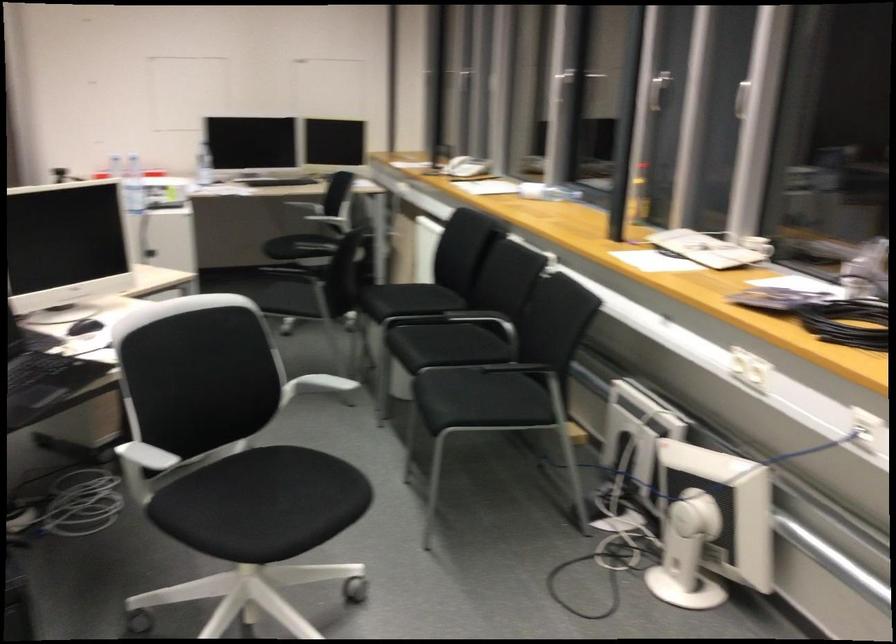
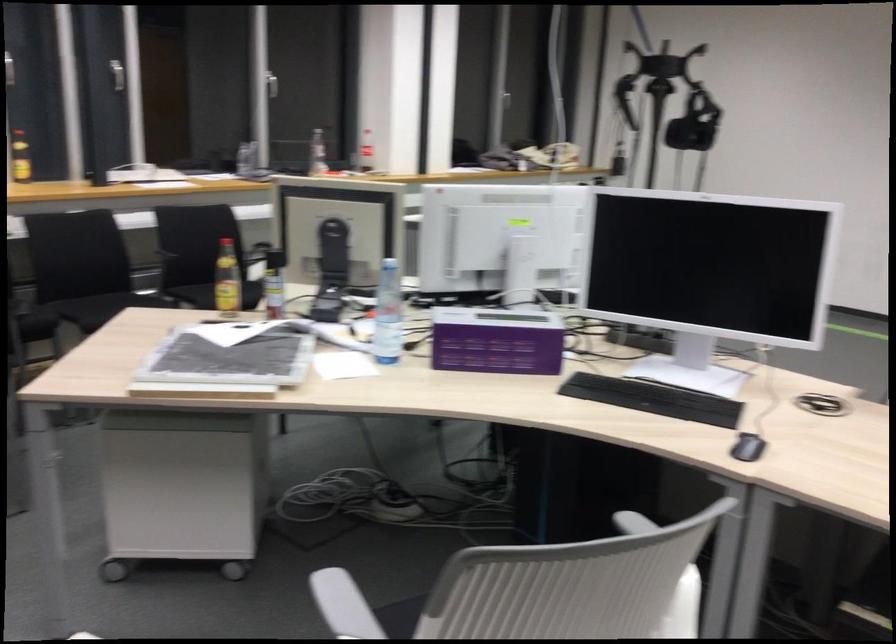
Find the pixel in the second image that matches (449,332) in the first image.

(90, 310)